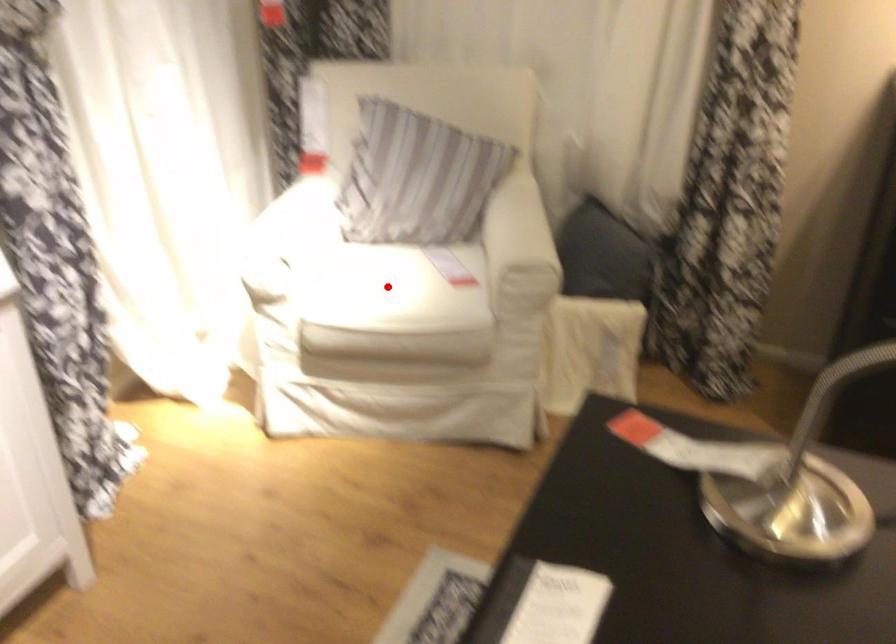
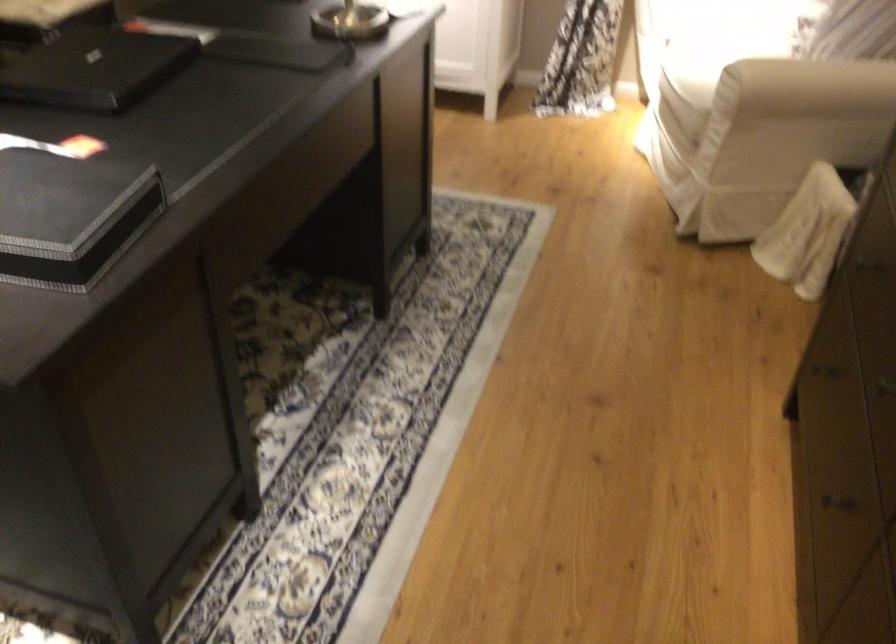
Question: I am providing you with two images of the same scene from different viewpoints. A red point is marked on the first image. Is the red point's position out of view in image 2?

Choices:
 (A) Yes
 (B) No

Answer: (A)